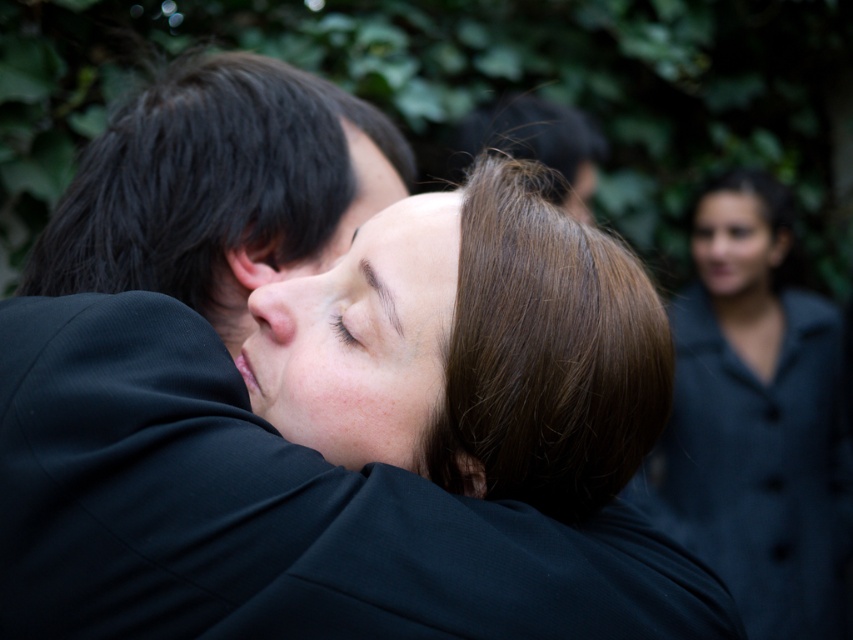
You are a photographer adjusting the camera focus. The matte black coat at upper right and the smooth skin face at upper right are both in the frame. If you want to ensure both are in focus, what is the minimum distance the camera should be set to focus at?

The minimum focusing distance should be set to 5.30 inches since the matte black coat at upper right is only 5.30 inches away from the smooth skin face at upper right, ensuring both are within the depth of field.